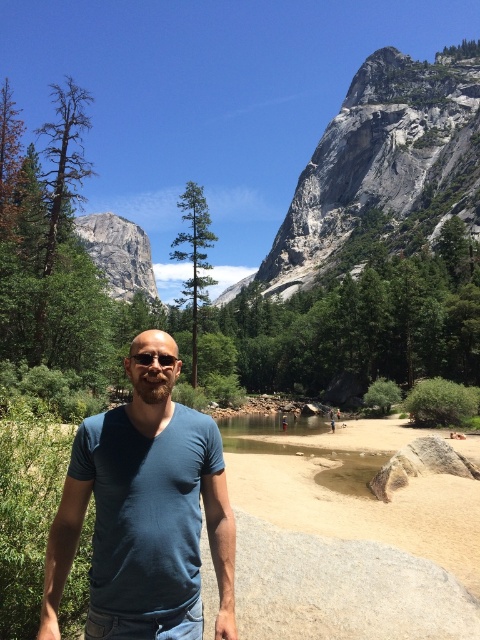
Question: Does gray/granite mountain at upper right appear under clear plastic goggles at center?

Choices:
 (A) no
 (B) yes

Answer: (A)

Question: Does gray/granite mountain at upper right appear over gray rough rock at lower right?

Choices:
 (A) yes
 (B) no

Answer: (A)

Question: Among these objects, which one is nearest to the camera?

Choices:
 (A) clear plastic goggles at center
 (B) blue cotton shirt at center
 (C) matte gray rock at upper center
 (D) gray/granite mountain at upper right

Answer: (B)

Question: Is matte gray rock at upper center smaller than clear plastic goggles at center?

Choices:
 (A) no
 (B) yes

Answer: (A)

Question: Estimate the real-world distances between objects in this image. Which object is farther from the blue cotton shirt at center?

Choices:
 (A) clear plastic goggles at center
 (B) gray rough rock at lower right
 (C) matte gray rock at upper center
 (D) gray/granite mountain at upper right

Answer: (C)

Question: Which object is closer to the camera taking this photo?

Choices:
 (A) blue cotton shirt at center
 (B) gray rough rock at lower right
 (C) matte gray rock at upper center
 (D) clear plastic goggles at center

Answer: (A)